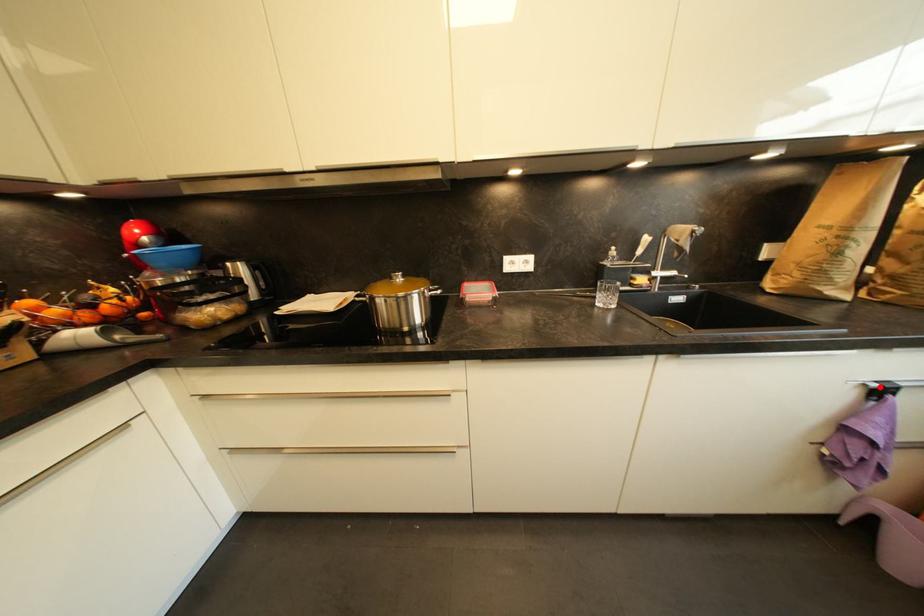
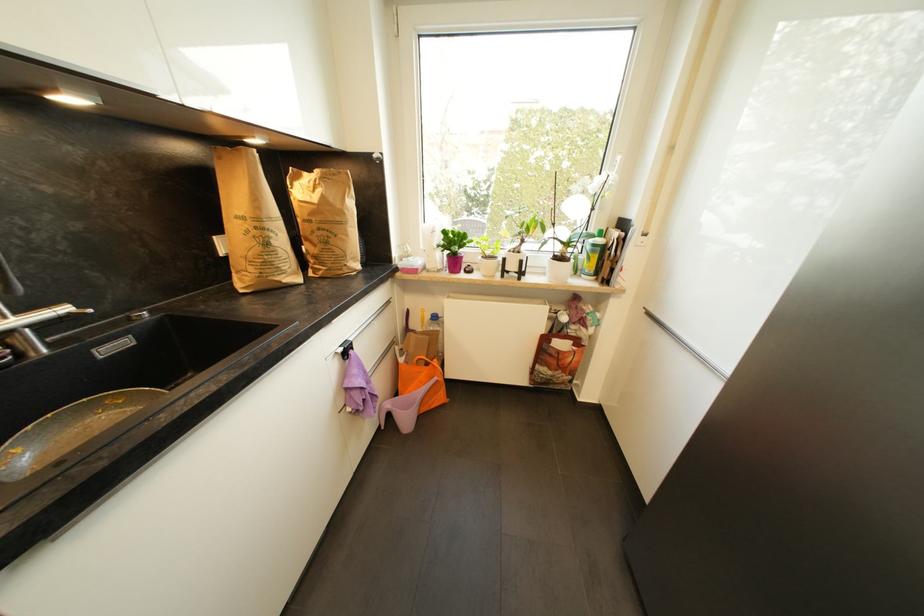
Question: I am providing you with two images of the same scene from different viewpoints. Image1 has a red point marked. In image2, the corresponding 3D location appears at what relative position? Reply with the corresponding letter.

Choices:
 (A) Closer
 (B) Farther

Answer: (B)